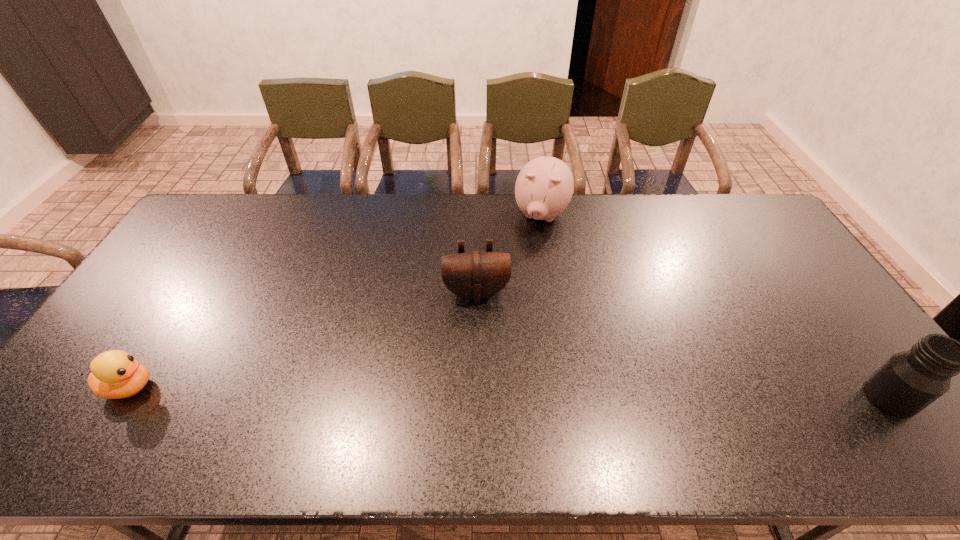
Where is `vacant area that lies between the third object from right to left and the jar`? vacant area that lies between the third object from right to left and the jar is located at coordinates (684, 345).

Find the location of a particular element. The image size is (960, 540). unoccupied area between the jar and the shortest object is located at coordinates point(510,392).

The width and height of the screenshot is (960, 540). Identify the location of free spot between the jar and the piggy bank. (716, 306).

Locate an element on the screen. This screenshot has width=960, height=540. empty location between the second object from left to right and the jar is located at coordinates (684, 345).

Identify which object is located as the third nearest to the duckling. Please provide its 2D coordinates. Your answer should be formatted as a tuple, i.e. [(x, y)], where the tuple contains the x and y coordinates of a point satisfying the conditions above.

[(908, 382)]

At what (x,y) coordinates should I click in order to perform the action: click on the closest object to the second farthest object. Please return your answer as a coordinate pair (x, y). This screenshot has height=540, width=960. Looking at the image, I should click on (544, 187).

Locate an element on the screen. This screenshot has height=540, width=960. free space that satisfies the following two spatial constraints: 1. on the front side of the rightmost object; 2. on the left side of the farthest object is located at coordinates (571, 397).

I want to click on free spot that satisfies the following two spatial constraints: 1. on the back side of the third object from right to left; 2. on the left side of the piggy bank, so click(477, 215).